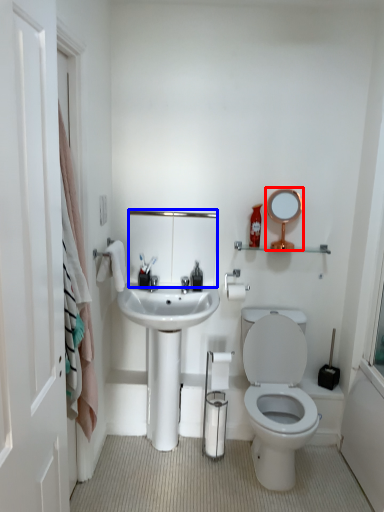
Question: Which of the following is the farthest to the observer, mirror (highlighted by a red box) or mirror (highlighted by a blue box)?

Choices:
 (A) mirror
 (B) mirror

Answer: (B)